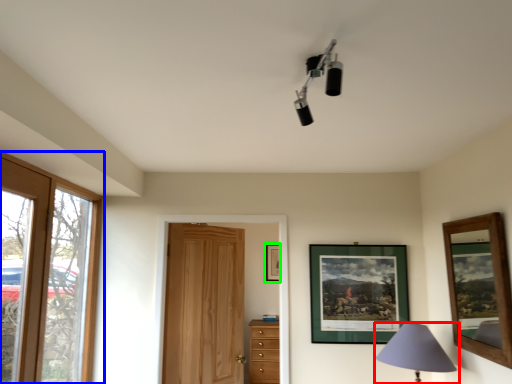
Question: Considering the real-world distances, which object is closest to lamp (highlighted by a red box)? window (highlighted by a blue box) or picture frame (highlighted by a green box).

Choices:
 (A) window
 (B) picture frame

Answer: (B)